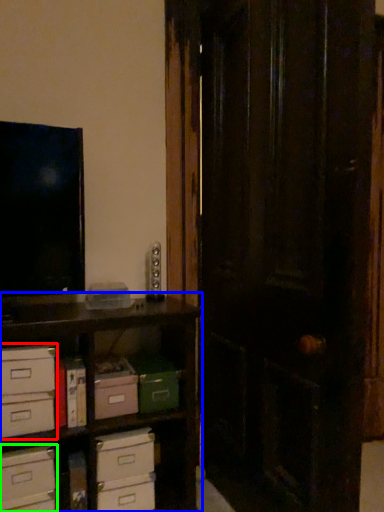
Question: Estimate the real-world distances between objects in this image. Which object is farther from chest of drawers (highlighted by a red box), shelf (highlighted by a blue box) or drawer (highlighted by a green box)?

Choices:
 (A) shelf
 (B) drawer

Answer: (A)